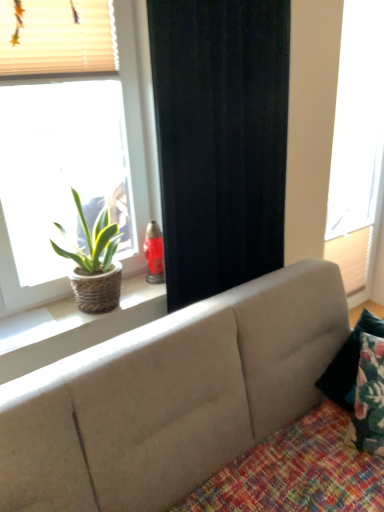
At what (x,y) coordinates should I click in order to perform the action: click on matte wicker basket at left, the 1th window in the front-to-back sequence. Please return your answer as a coordinate pair (x, y). The image size is (384, 512). Looking at the image, I should click on (138, 121).

Describe the element at coordinates (170, 397) in the screenshot. Image resolution: width=384 pixels, height=512 pixels. I see `beige fabric couch at center` at that location.

The image size is (384, 512). Describe the element at coordinates (297, 472) in the screenshot. I see `multicolored woven quilt at lower right` at that location.

Identify the location of white matte window at right, which ranks as the first window in back-to-front order. Image resolution: width=384 pixels, height=512 pixels. (357, 120).

What do you see at coordinates (58, 37) in the screenshot?
I see `beige fabric blinds at upper left` at bounding box center [58, 37].

The image size is (384, 512). I want to click on beige fabric blinds at upper left, so click(58, 37).

Image resolution: width=384 pixels, height=512 pixels. In order to click on floral fabric pillow at lower right in this screenshot , I will do (348, 362).

What is the approximate width of floral fabric pillow at lower right?

It is 16.27 centimeters.

Identify the location of matte wicker basket at left, the 1th window in the front-to-back sequence. (138, 121).

Is black fabric curtain at center inside the boundaries of floral fabric pillow at lower right, or outside?

The correct answer is: outside.

From a real-world perspective, is black fabric curtain at center positioned under floral fabric pillow at lower right based on gravity?

Actually, black fabric curtain at center is physically above floral fabric pillow at lower right in the real world.

Between black fabric curtain at center and floral fabric pillow at lower right, which one appears on the right side from the viewer's perspective?

Positioned to the right is floral fabric pillow at lower right.

Is point (279, 34) closer or farther from the camera than point (327, 390)?

Point (279, 34) is positioned closer to the camera compared to point (327, 390).

Considering the relative positions of beige fabric blinds at upper left and natural wood window sill at upper left in the image provided, is beige fabric blinds at upper left to the right of natural wood window sill at upper left from the viewer's perspective?

No, beige fabric blinds at upper left is not to the right of natural wood window sill at upper left.

Locate an element on the screen. Image resolution: width=384 pixels, height=512 pixels. window sill that is below the beige fabric blinds at upper left (from the image's perspective) is located at coordinates (73, 327).

Is beige fabric blinds at upper left aimed at natural wood window sill at upper left?

No, beige fabric blinds at upper left is not oriented towards natural wood window sill at upper left.

Who is shorter, beige fabric blinds at upper left or natural wood window sill at upper left?

natural wood window sill at upper left.

Considering the relative sizes of natural wood window sill at upper left and beige fabric couch at center in the image provided, is natural wood window sill at upper left bigger than beige fabric couch at center?

No.

From the image's perspective, is natural wood window sill at upper left on beige fabric couch at center?

Yes.

Is natural wood window sill at upper left situated inside beige fabric couch at center or outside?

natural wood window sill at upper left is spatially situated outside beige fabric couch at center.

How much distance is there between multicolored woven quilt at lower right and white matte window at right, arranged as the 2th window when viewed from the left?

multicolored woven quilt at lower right is 7.10 feet away from white matte window at right, arranged as the 2th window when viewed from the left.

Considering the positions of objects multicolored woven quilt at lower right and white matte window at right, arranged as the 2th window when viewed from the left, in the image provided, who is more to the left, multicolored woven quilt at lower right or white matte window at right, arranged as the 2th window when viewed from the left,?

From the viewer's perspective, multicolored woven quilt at lower right appears more on the left side.

Considering the relative sizes of multicolored woven quilt at lower right and white matte window at right, placed as the 1th window when sorted from right to left, in the image provided, is multicolored woven quilt at lower right smaller than white matte window at right, placed as the 1th window when sorted from right to left,?

Actually, multicolored woven quilt at lower right might be larger than white matte window at right, placed as the 1th window when sorted from right to left.

Is multicolored woven quilt at lower right oriented away from white matte window at right, placed as the 1th window when sorted from right to left?

multicolored woven quilt at lower right does not have its back to white matte window at right, placed as the 1th window when sorted from right to left.

Does floral fabric pillow at lower right touch beige fabric couch at center?

No, floral fabric pillow at lower right is not making contact with beige fabric couch at center.

Can you confirm if floral fabric pillow at lower right is smaller than beige fabric couch at center?

Indeed, floral fabric pillow at lower right has a smaller size compared to beige fabric couch at center.

Do you think floral fabric pillow at lower right is within beige fabric couch at center, or outside of it?

floral fabric pillow at lower right is spatially positioned inside beige fabric couch at center.

Is matte wicker basket at left, the 2th window viewed from the back, facing towards floral fabric pillow at lower right?

No, matte wicker basket at left, the 2th window viewed from the back, is not oriented towards floral fabric pillow at lower right.

Considering the points (152, 215) and (337, 381), which point is in front, point (152, 215) or point (337, 381)?

The point (337, 381) is closer to the camera.

Find the location of a particular element. pillow that appears below the matte wicker basket at left, the 2th window viewed from the back (from the image's perspective) is located at coordinates (348, 362).

Is matte wicker basket at left, which is counted as the 2th window, starting from the right, smaller than floral fabric pillow at lower right?

Incorrect, matte wicker basket at left, which is counted as the 2th window, starting from the right, is not smaller in size than floral fabric pillow at lower right.

Which of these two, natural wood window sill at upper left or beige fabric blinds at upper left, is smaller?

beige fabric blinds at upper left.

From a real-world perspective, is natural wood window sill at upper left positioned above or below beige fabric blinds at upper left?

natural wood window sill at upper left is situated lower than beige fabric blinds at upper left in the real world.

Find the location of a particular element. The width and height of the screenshot is (384, 512). window sill below the beige fabric blinds at upper left (from the image's perspective) is located at coordinates (73, 327).

How far apart are natural wood window sill at upper left and beige fabric blinds at upper left?

The distance of natural wood window sill at upper left from beige fabric blinds at upper left is 37.25 inches.

Locate an element on the screen. curtain located in front of the floral fabric pillow at lower right is located at coordinates (220, 140).

Identify the location of window sill below the beige fabric blinds at upper left (from the image's perspective). This screenshot has width=384, height=512. (73, 327).

Considering their positions, is floral fabric pillow at lower right positioned further to matte wicker basket at left, which is counted as the 2th window, starting from the right, than multicolored woven quilt at lower right?

multicolored woven quilt at lower right is positioned further to the anchor matte wicker basket at left, which is counted as the 2th window, starting from the right.

Estimate the real-world distances between objects in this image. Which object is closer to multicolored woven quilt at lower right, black fabric curtain at center or beige fabric couch at center?

Based on the image, beige fabric couch at center appears to be nearer to multicolored woven quilt at lower right.

Which object lies further to the anchor point matte wicker basket at left, arranged as the first window when viewed from the left, natural wood window sill at upper left or beige fabric couch at center?

Among the two, beige fabric couch at center is located further to matte wicker basket at left, arranged as the first window when viewed from the left.

When comparing their distances from natural wood window sill at upper left, does beige fabric blinds at upper left or floral fabric pillow at lower right seem further?

Based on the image, floral fabric pillow at lower right appears to be further to natural wood window sill at upper left.

Considering their positions, is floral fabric pillow at lower right positioned further to natural wood window sill at upper left than beige fabric blinds at upper left?

The object further to natural wood window sill at upper left is floral fabric pillow at lower right.

Based on their spatial positions, is matte wicker basket at left, the 2th window viewed from the back, or white matte window at right, arranged as the 2th window when viewed from the front, closer to beige fabric couch at center?

matte wicker basket at left, the 2th window viewed from the back, is closer to beige fabric couch at center.

From the image, which object appears to be nearer to multicolored woven quilt at lower right, white matte window at right, which ranks as the first window in back-to-front order, or black fabric curtain at center?

black fabric curtain at center is closer to multicolored woven quilt at lower right.

Estimate the real-world distances between objects in this image. Which object is closer to natural wood window sill at upper left, beige fabric couch at center or floral fabric pillow at lower right?

The object closer to natural wood window sill at upper left is beige fabric couch at center.

Locate an element on the screen. curtain between beige fabric blinds at upper left and multicolored woven quilt at lower right from top to bottom is located at coordinates (220, 140).

Image resolution: width=384 pixels, height=512 pixels. In order to click on pillow between natural wood window sill at upper left and white matte window at right, arranged as the 2th window when viewed from the front, from left to right in this screenshot , I will do `click(348, 362)`.

I want to click on curtain between beige fabric blinds at upper left and natural wood window sill at upper left in the vertical direction, so click(x=220, y=140).

Where is `studio couch situated between matte wicker basket at left, the 1th window in the front-to-back sequence, and floral fabric pillow at lower right from left to right`? The image size is (384, 512). studio couch situated between matte wicker basket at left, the 1th window in the front-to-back sequence, and floral fabric pillow at lower right from left to right is located at coordinates (170, 397).